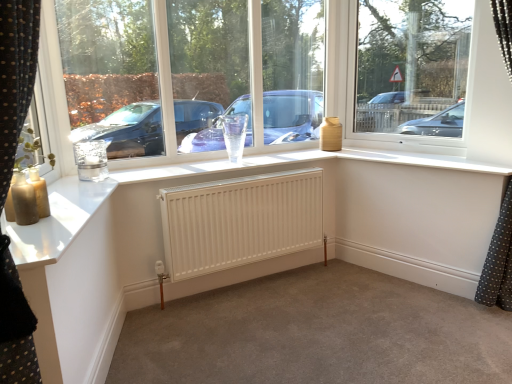
Question: From a real-world perspective, is white matte radiator at center on white matte radiator at center?

Choices:
 (A) yes
 (B) no

Answer: (B)

Question: Considering the relative sizes of white matte radiator at center and white matte radiator at center in the image provided, is white matte radiator at center wider than white matte radiator at center?

Choices:
 (A) no
 (B) yes

Answer: (B)

Question: Is white matte radiator at center oriented away from white matte radiator at center?

Choices:
 (A) no
 (B) yes

Answer: (A)

Question: Does white matte radiator at center have a greater height compared to white matte radiator at center?

Choices:
 (A) yes
 (B) no

Answer: (A)

Question: From the image's perspective, is white matte radiator at center on white matte radiator at center?

Choices:
 (A) yes
 (B) no

Answer: (B)

Question: Is white matte radiator at center located within white matte radiator at center?

Choices:
 (A) yes
 (B) no

Answer: (B)

Question: Is transparent glass window at upper right oriented away from white matte radiator at center?

Choices:
 (A) yes
 (B) no

Answer: (B)

Question: Can you confirm if transparent glass window at upper right is positioned to the right of white matte radiator at center?

Choices:
 (A) no
 (B) yes

Answer: (B)

Question: From the image's perspective, is transparent glass window at upper right located above white matte radiator at center?

Choices:
 (A) yes
 (B) no

Answer: (A)

Question: Are transparent glass window at upper right and white matte radiator at center beside each other?

Choices:
 (A) yes
 (B) no

Answer: (B)

Question: From the image's perspective, does transparent glass window at upper right appear lower than white matte radiator at center?

Choices:
 (A) no
 (B) yes

Answer: (A)

Question: From a real-world perspective, does transparent glass window at upper right sit lower than white matte radiator at center?

Choices:
 (A) no
 (B) yes

Answer: (A)

Question: Is transparent glass window at upper right in front of white matte radiator at center?

Choices:
 (A) yes
 (B) no

Answer: (B)